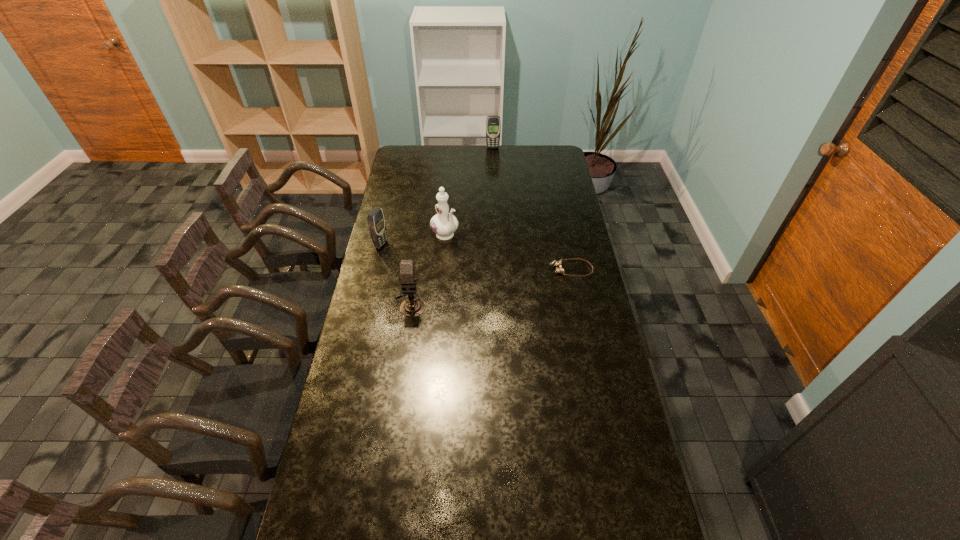
What are the coordinates of `vacant space located on the front lenses and sides of the rightmost object` in the screenshot? It's located at [x=475, y=269].

You are a GUI agent. You are given a task and a screenshot of the screen. Output one action in this format:
    pyautogui.click(x=<x>, y=<y>)
    Task: Click on the vacant area located on the front lenses and sides of the rightmost object
    The width and height of the screenshot is (960, 540).
    Given the screenshot: What is the action you would take?
    pyautogui.click(x=490, y=269)

Image resolution: width=960 pixels, height=540 pixels. I want to click on vacant position located 0.260m at the spout of the chinaware, so click(x=487, y=279).

At what (x,y) coordinates should I click in order to perform the action: click on free spot located 0.250m at the spout of the chinaware. Please return your answer as a coordinate pair (x, y). The height and width of the screenshot is (540, 960). Looking at the image, I should click on (486, 278).

The width and height of the screenshot is (960, 540). I want to click on free space located at the spout of the chinaware, so click(x=467, y=258).

You are a GUI agent. You are given a task and a screenshot of the screen. Output one action in this format:
    pyautogui.click(x=<x>, y=<y>)
    Task: Click on the free space located on the screen of the right cellular telephone
    
    Given the screenshot: What is the action you would take?
    pyautogui.click(x=493, y=154)

Identify the location of free spot located on the screen of the right cellular telephone. (493, 163).

At what (x,y) coordinates should I click in order to perform the action: click on free space located 0.210m on the screen of the right cellular telephone. Please return your answer as a coordinate pair (x, y). Looking at the image, I should click on (494, 169).

Image resolution: width=960 pixels, height=540 pixels. Find the location of `vacant point located 0.150m on the front face of the leftmost object`. vacant point located 0.150m on the front face of the leftmost object is located at coordinates (417, 256).

Locate an element on the screen. This screenshot has height=540, width=960. free region located on the front face of the leftmost object is located at coordinates (466, 271).